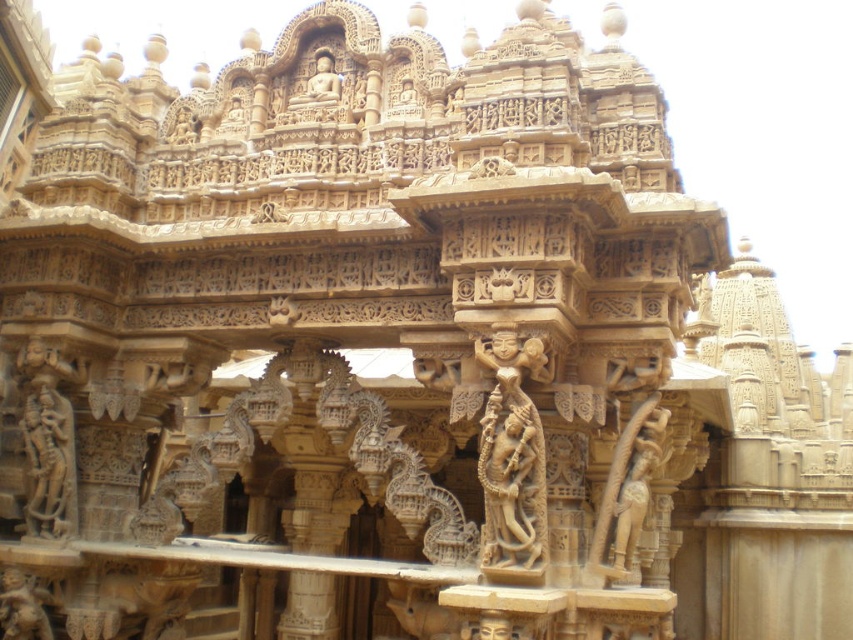
Question: Which object is the farthest from the carved beige statue at center?

Choices:
 (A) beige stone sculpture at center
 (B) golden sandstone statue at center
 (C) beige stone statue at left
 (D) golden sandstone statue at lower left

Answer: (D)

Question: Is beige stone statue at left above golden sandstone statue at lower left?

Choices:
 (A) yes
 (B) no

Answer: (A)

Question: Is beige stone statue at left to the left of carved beige statue at center from the viewer's perspective?

Choices:
 (A) yes
 (B) no

Answer: (A)

Question: Among these points, which one is farthest from the camera?

Choices:
 (A) (36, 632)
 (B) (323, 64)
 (C) (48, 538)

Answer: (B)

Question: Considering the real-world distances, which object is closest to the golden sandstone statue at center?

Choices:
 (A) carved beige statue at center
 (B) beige stone sculpture at center

Answer: (B)

Question: Does golden sandstone statue at lower left have a smaller size compared to golden sandstone statue at center?

Choices:
 (A) no
 (B) yes

Answer: (A)